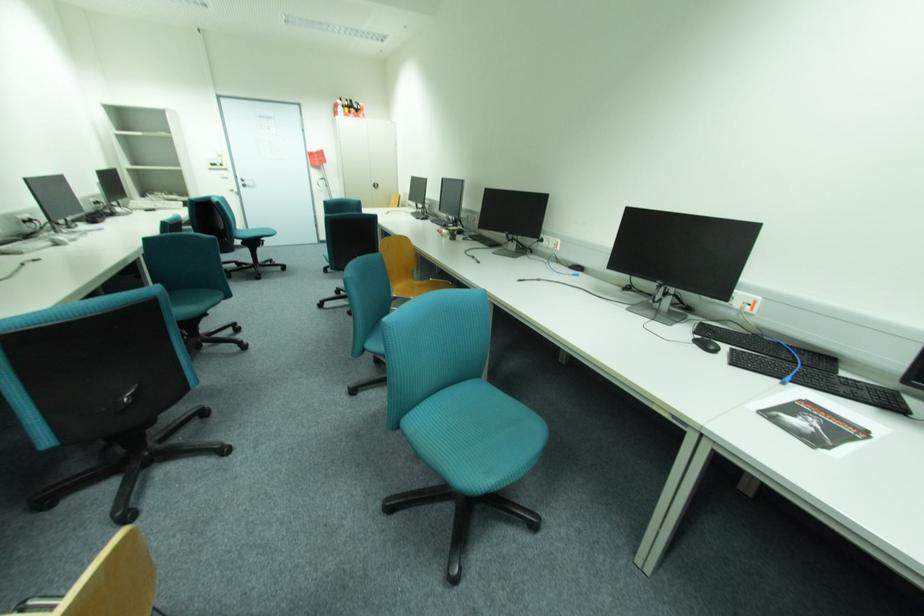
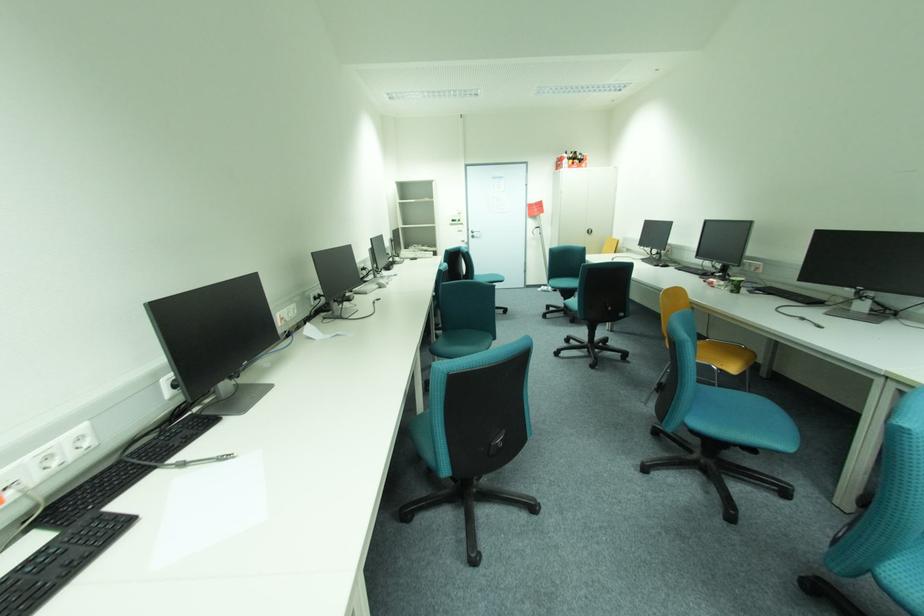
The point at (248, 183) is marked in the first image. Where is the corresponding point in the second image?

(477, 235)